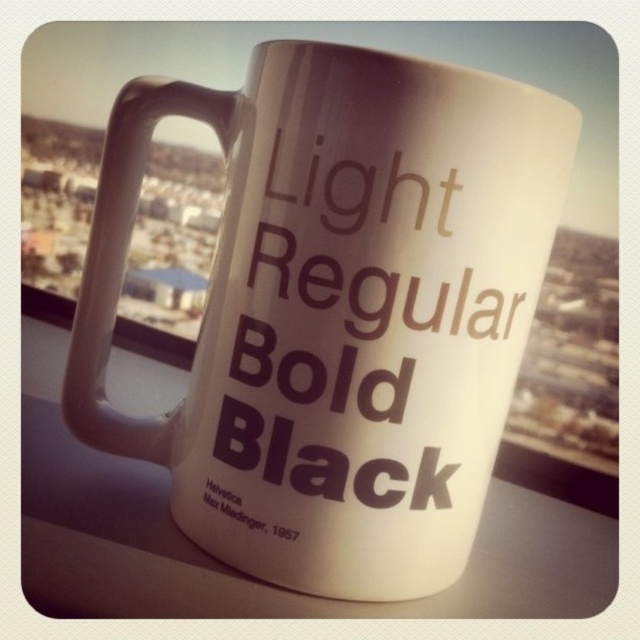
Question: Does bold matte text at center appear under black matte text at lower left?

Choices:
 (A) no
 (B) yes

Answer: (A)

Question: Among these objects, which one is farthest from the camera?

Choices:
 (A) white matte mug at center
 (B) black matte text at lower left

Answer: (B)

Question: Is white matte mug at center bigger than black matte text at lower left?

Choices:
 (A) yes
 (B) no

Answer: (A)

Question: Can you confirm if white matte mug at center is positioned to the left of black matte text at lower left?

Choices:
 (A) no
 (B) yes

Answer: (A)

Question: Which object appears closest to the camera in this image?

Choices:
 (A) black matte text at lower left
 (B) white matte mug at center

Answer: (B)

Question: Among these objects, which one is farthest from the camera?

Choices:
 (A) black matte text at lower left
 (B) white matte mug at center

Answer: (A)